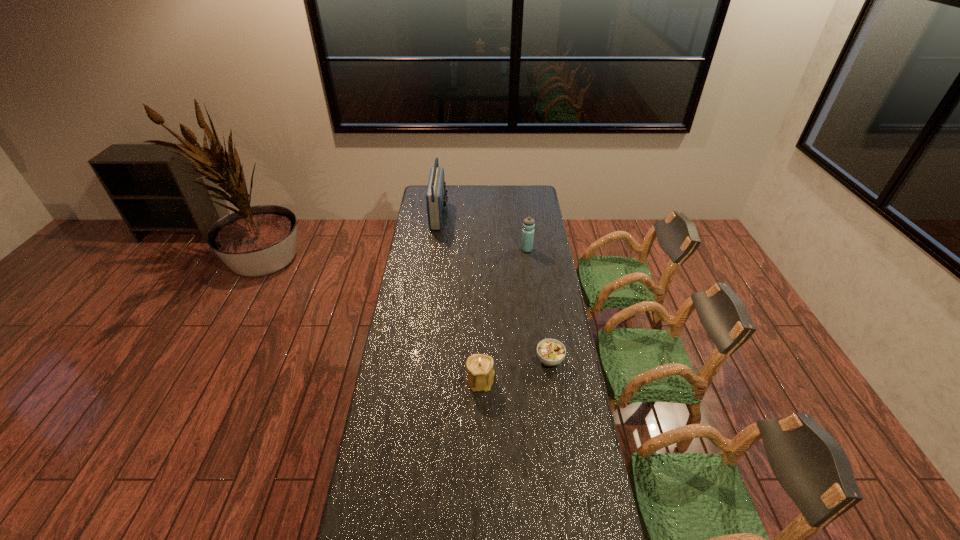
The height and width of the screenshot is (540, 960). I want to click on free area in between the third object from right to left and the tallest object, so click(460, 298).

The height and width of the screenshot is (540, 960). Find the location of `empty location between the third object from right to left and the water bottle`. empty location between the third object from right to left and the water bottle is located at coordinates (504, 315).

Find the location of a particular element. The height and width of the screenshot is (540, 960). free spot between the third object from right to left and the farthest object is located at coordinates (460, 298).

Identify the location of empty space that is in between the shortest object and the third nearest object. (539, 305).

You are a GUI agent. You are given a task and a screenshot of the screen. Output one action in this format:
    pyautogui.click(x=<x>, y=<y>)
    Task: Click on the free spot between the candle_holder and the leftmost object
    This screenshot has width=960, height=540.
    Given the screenshot: What is the action you would take?
    pyautogui.click(x=460, y=298)

Where is `free space between the shortest object and the leftmost object`? free space between the shortest object and the leftmost object is located at coordinates (494, 287).

Find the location of `free spot between the second farthest object and the shortest object`. free spot between the second farthest object and the shortest object is located at coordinates (539, 305).

This screenshot has height=540, width=960. What are the coordinates of `free space between the third object from right to left and the soup bowl` in the screenshot? It's located at (516, 370).

Select which object appears as the second closest to the second farthest object. Please provide its 2D coordinates. Your answer should be formatted as a tuple, i.e. [(x, y)], where the tuple contains the x and y coordinates of a point satisfying the conditions above.

[(551, 352)]

I want to click on object that is the closest to the farthest object, so click(529, 223).